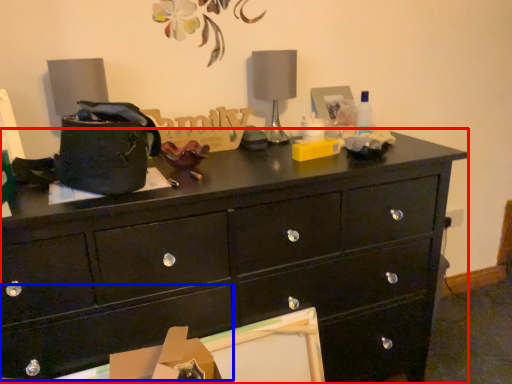
Question: Which object appears closest to the camera in this image, chest of drawers (highlighted by a red box) or drawer (highlighted by a blue box)?

Choices:
 (A) chest of drawers
 (B) drawer

Answer: (B)